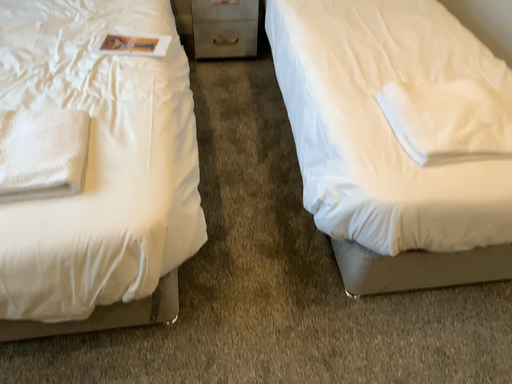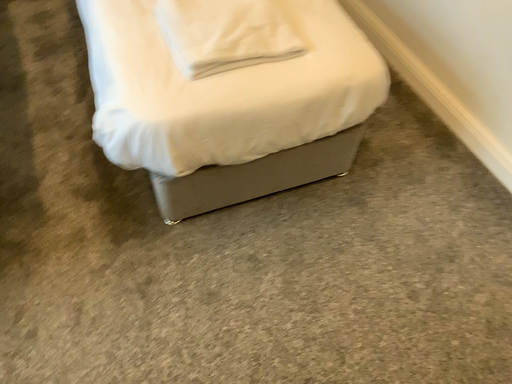
Question: Which way did the camera rotate in the video?

Choices:
 (A) rotated upward
 (B) rotated downward

Answer: (B)